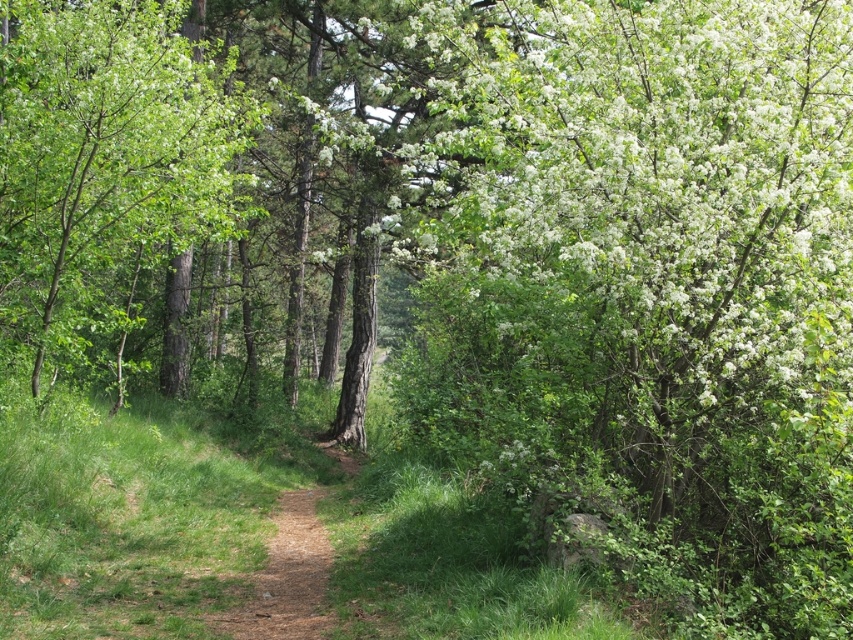
Looking at this image, you are standing at the entrance of the forest path and see a point marked at coordinates (106,168). What object is located at that point?

The point at coordinates (106,168) marks the location of the green matte tree at center.

You are standing at the starting point of the forest path and want to locate the green matte tree at center. According to the coordinates provided, where should you look relative to your position?

The green matte tree at center is located at coordinates point 0.264 on the x axis and 0.125 on the y axis relative to your position.